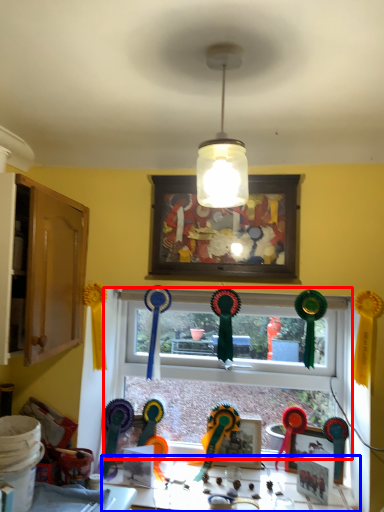
Question: Which object is further to the camera taking this photo, window (highlighted by a red box) or table (highlighted by a blue box)?

Choices:
 (A) window
 (B) table

Answer: (A)